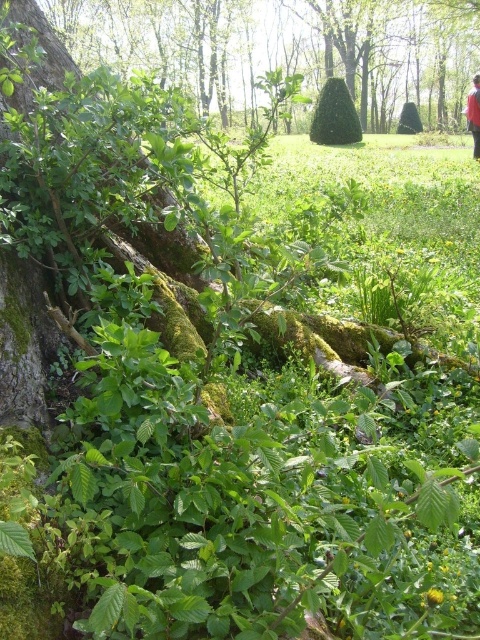
Question: Which point is farther to the camera?

Choices:
 (A) [468, 116]
 (B) [267, 3]

Answer: (B)

Question: Considering the relative positions of green mossy tree at upper left and red fabric person at upper right in the image provided, where is green mossy tree at upper left located with respect to red fabric person at upper right?

Choices:
 (A) right
 (B) left

Answer: (B)

Question: Can you confirm if green mossy tree at upper left is positioned to the right of red fabric person at upper right?

Choices:
 (A) no
 (B) yes

Answer: (A)

Question: Which point appears farthest from the camera in this image?

Choices:
 (A) (476, 136)
 (B) (352, 58)

Answer: (B)

Question: Does green mossy tree at upper left appear under red fabric person at upper right?

Choices:
 (A) yes
 (B) no

Answer: (B)